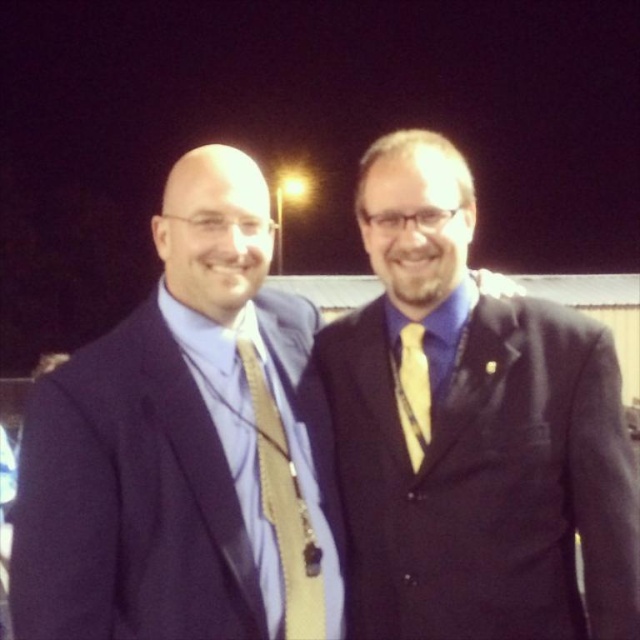
Question: Can you confirm if matte black suit at center is thinner than matte blue suit at left?

Choices:
 (A) yes
 (B) no

Answer: (A)

Question: Which object appears farthest from the camera in this image?

Choices:
 (A) matte blue suit at left
 (B) matte black suit at center

Answer: (B)

Question: Which is farther from the matte black suit at center?

Choices:
 (A) gold silk tie at center
 (B) yellow silk tie at right

Answer: (B)

Question: Is matte black suit at center below gold silk tie at center?

Choices:
 (A) no
 (B) yes

Answer: (A)

Question: Is matte black suit at center further to camera compared to yellow silk tie at right?

Choices:
 (A) no
 (B) yes

Answer: (A)

Question: Which of the following is the closest to the observer?

Choices:
 (A) (24, 460)
 (B) (420, 340)
 (C) (33, 426)

Answer: (A)